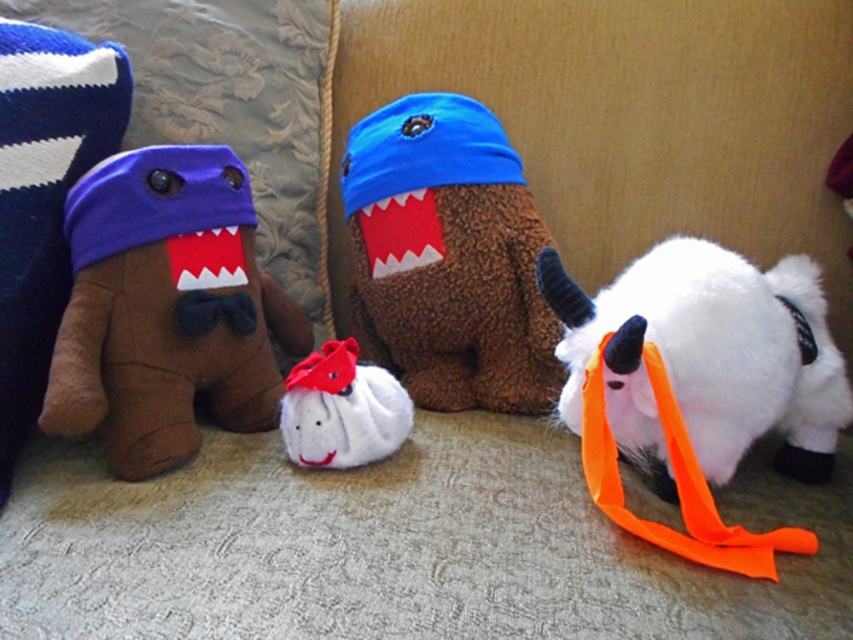
Does brown plush toy at left have a greater height compared to brown fuzzy stuffed toy at center?

In fact, brown plush toy at left may be shorter than brown fuzzy stuffed toy at center.

In the scene shown: Can you confirm if brown plush toy at left is positioned below brown fuzzy stuffed toy at center?

Correct, brown plush toy at left is located below brown fuzzy stuffed toy at center.

You are a GUI agent. You are given a task and a screenshot of the screen. Output one action in this format:
    pyautogui.click(x=<x>, y=<y>)
    Task: Click on the brown plush toy at left
    The width and height of the screenshot is (853, 640).
    Given the screenshot: What is the action you would take?
    pyautogui.click(x=166, y=308)

Is point (363, 180) positioned in front of point (659, 433)?

That is False.

What do you see at coordinates (448, 257) in the screenshot? I see `brown fuzzy stuffed toy at center` at bounding box center [448, 257].

Find the location of `brown fuzzy stuffed toy at center`. brown fuzzy stuffed toy at center is located at coordinates (448, 257).

Which is in front, point (367, 273) or point (399, 410)?

Point (399, 410) is more forward.

Which is in front, point (508, 209) or point (373, 406)?

Point (373, 406) is more forward.

This screenshot has height=640, width=853. I want to click on brown fuzzy stuffed toy at center, so click(448, 257).